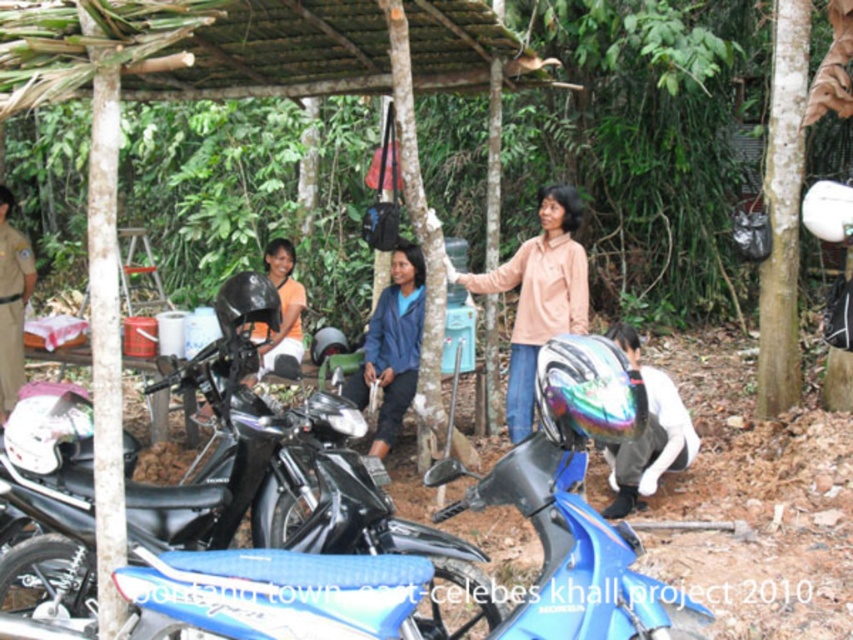
Question: Is blue glossy motorcycle at lower center smaller than rainbow reflective helmet at lower right?

Choices:
 (A) yes
 (B) no

Answer: (B)

Question: Considering the real-world distances, which object is farthest from the blue glossy motorcycle at lower center?

Choices:
 (A) matte black helmet at left
 (B) brown uniform at left
 (C) matte pink shirt at center
 (D) rainbow reflective helmet at lower right

Answer: (B)

Question: Which of the following is the closest to the observer?

Choices:
 (A) brown uniform at left
 (B) blue glossy motorcycle at lower center

Answer: (B)

Question: Is rainbow reflective helmet at lower right positioned before matte black helmet at left?

Choices:
 (A) yes
 (B) no

Answer: (A)

Question: Which point appears farthest from the camera in this image?

Choices:
 (A) (294, 314)
 (B) (535, 316)
 (C) (207, 620)
 (D) (6, 368)

Answer: (A)

Question: Is matte pink shirt at center bigger than rainbow reflective helmet at lower right?

Choices:
 (A) yes
 (B) no

Answer: (A)